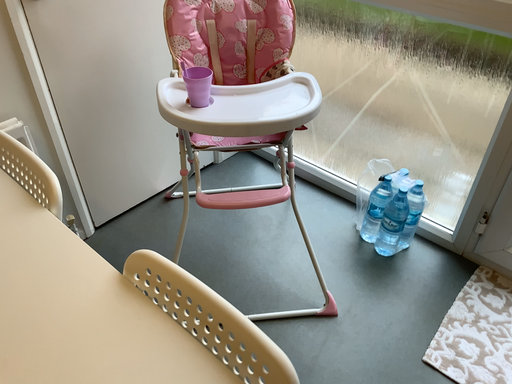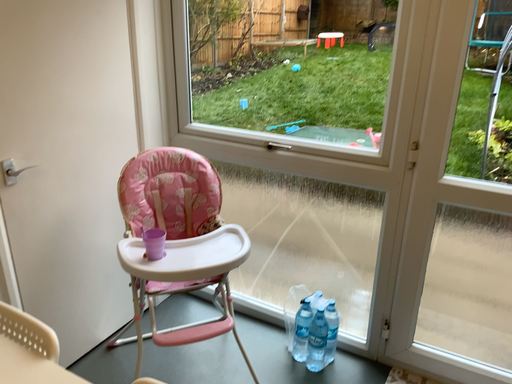
Question: How did the camera likely rotate when shooting the video?

Choices:
 (A) rotated left
 (B) rotated right

Answer: (B)